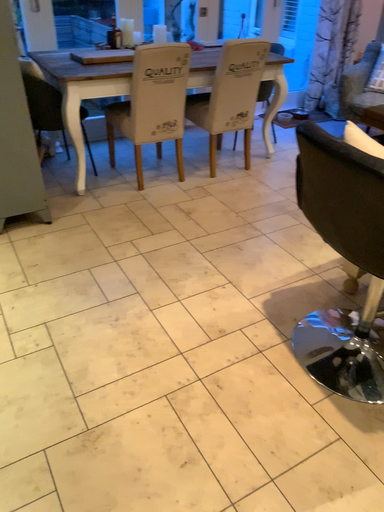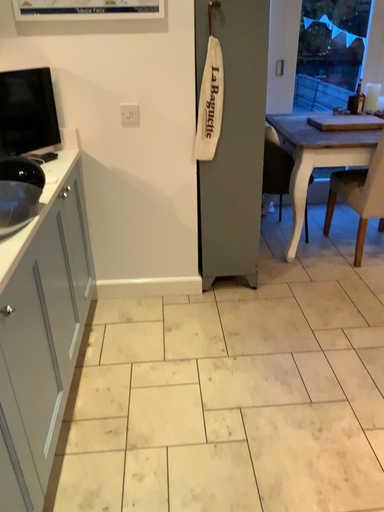
Question: Which way did the camera rotate in the video?

Choices:
 (A) rotated right
 (B) rotated left

Answer: (B)